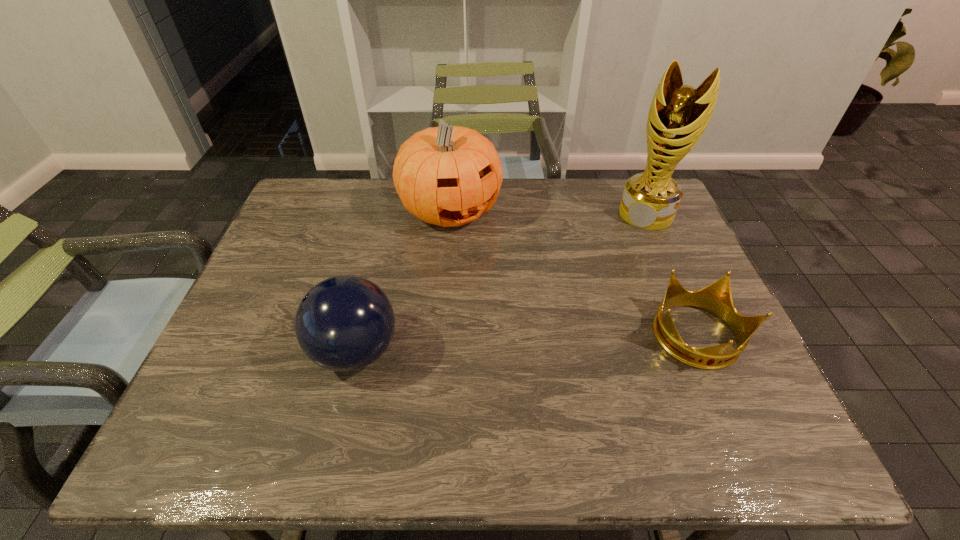
You are a GUI agent. You are given a task and a screenshot of the screen. Output one action in this format:
    pyautogui.click(x=<x>, y=<y>)
    Task: Click on the unoccupied position between the third tallest object and the pumpkin
    The width and height of the screenshot is (960, 540).
    Given the screenshot: What is the action you would take?
    pyautogui.click(x=403, y=281)

Locate an element on the screen. Image resolution: width=960 pixels, height=540 pixels. blank region between the second shortest object and the crown is located at coordinates (526, 345).

Find the location of a particular element. This screenshot has height=540, width=960. free space between the crown and the second shortest object is located at coordinates (526, 345).

Where is `vacant space in between the third shortest object and the bowling ball`? The image size is (960, 540). vacant space in between the third shortest object and the bowling ball is located at coordinates (403, 281).

Find the location of `free spot between the shortest object and the pumpkin`. free spot between the shortest object and the pumpkin is located at coordinates (573, 274).

I want to click on unoccupied area between the shortest object and the second tallest object, so click(x=573, y=274).

You are a GUI agent. You are given a task and a screenshot of the screen. Output one action in this format:
    pyautogui.click(x=<x>, y=<y>)
    Task: Click on the vacant area that lies between the award and the bowling ball
    This screenshot has width=960, height=540.
    Given the screenshot: What is the action you would take?
    pyautogui.click(x=501, y=282)

At what (x,y) coordinates should I click in order to perform the action: click on object that is the third closest to the bowling ball. Please return your answer as a coordinate pair (x, y). The image size is (960, 540). Looking at the image, I should click on (678, 115).

This screenshot has height=540, width=960. In order to click on object that is the nearest to the award in this screenshot , I will do `click(716, 298)`.

This screenshot has width=960, height=540. What are the coordinates of `free point that satisfies the following two spatial constraints: 1. on the front side of the award; 2. on the right side of the pumpkin` in the screenshot? It's located at (449, 214).